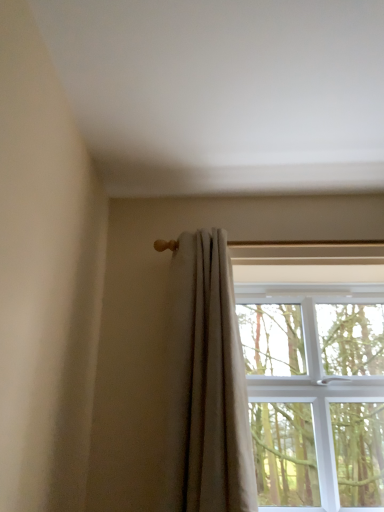
Question: Considering the positions of light beige fabric curtain at upper right and clear glass window at upper right in the image, is light beige fabric curtain at upper right taller or shorter than clear glass window at upper right?

Choices:
 (A) short
 (B) tall

Answer: (B)

Question: Does point (208, 284) appear closer or farther from the camera than point (264, 247)?

Choices:
 (A) farther
 (B) closer

Answer: (B)

Question: Considering the relative positions of light beige fabric curtain at upper right and clear glass window at upper right in the image provided, is light beige fabric curtain at upper right to the left or to the right of clear glass window at upper right?

Choices:
 (A) left
 (B) right

Answer: (A)

Question: Is clear glass window at upper right taller or shorter than light beige fabric curtain at upper right?

Choices:
 (A) tall
 (B) short

Answer: (B)

Question: From the image's perspective, relative to light beige fabric curtain at upper right, is clear glass window at upper right above or below?

Choices:
 (A) below
 (B) above

Answer: (A)

Question: From a real-world perspective, is clear glass window at upper right above or below light beige fabric curtain at upper right?

Choices:
 (A) below
 (B) above

Answer: (A)

Question: Considering the relative positions of clear glass window at upper right and light beige fabric curtain at upper right in the image provided, is clear glass window at upper right to the left or to the right of light beige fabric curtain at upper right?

Choices:
 (A) right
 (B) left

Answer: (A)